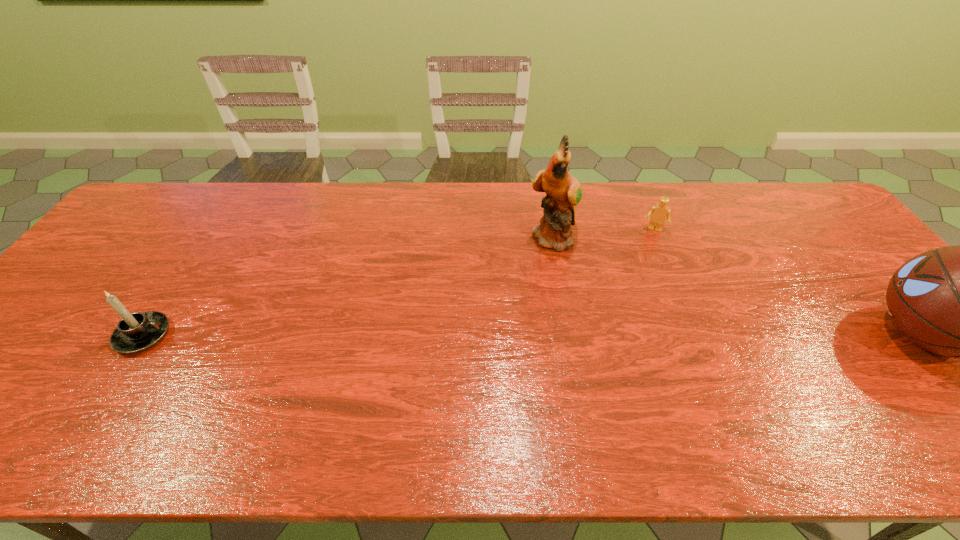
This screenshot has height=540, width=960. I want to click on vacant spot on the desktop that is between the leftmost object and the basketball and is positioned on the front-facing side of the parrot, so click(x=633, y=335).

This screenshot has width=960, height=540. What are the coordinates of `vacant space on the desktop that is between the second shortest object and the second tallest object and is positioned on the face of the shortest object` in the screenshot? It's located at (x=630, y=335).